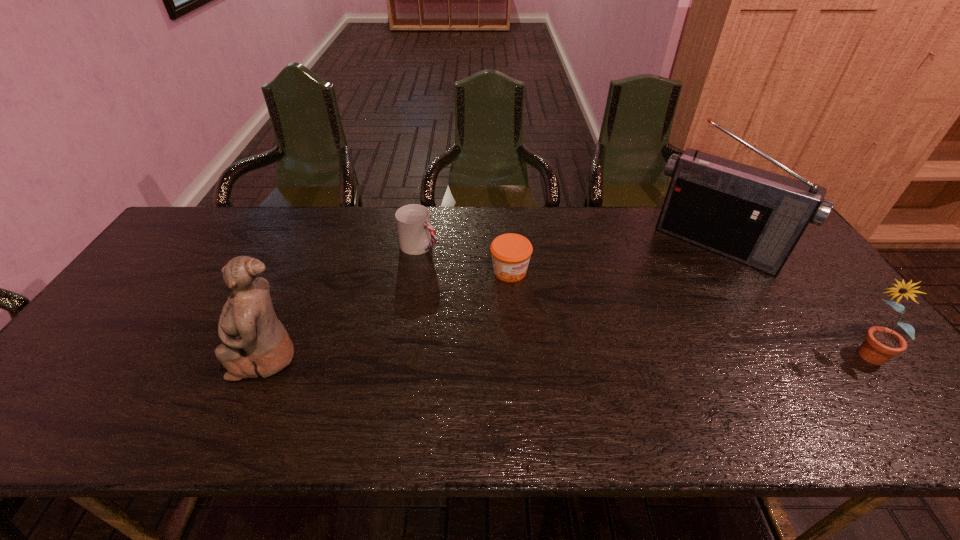
The height and width of the screenshot is (540, 960). I want to click on vacant space situated 0.250m on the front-facing side of the leftmost object, so click(132, 355).

Find the location of a particular element. This screenshot has height=540, width=960. free space located 0.320m on the front label of the shortest object is located at coordinates (604, 359).

Locate an element on the screen. The image size is (960, 540). vacant point located 0.280m on the front label of the shortest object is located at coordinates (592, 348).

I want to click on free location located on the front label of the shortest object, so click(555, 313).

Where is `vacant space located 0.220m on the handle side of the second shortest object`? The height and width of the screenshot is (540, 960). vacant space located 0.220m on the handle side of the second shortest object is located at coordinates (489, 287).

Find the location of a particular element. This screenshot has width=960, height=540. vacant space located on the handle side of the second shortest object is located at coordinates (468, 274).

At what (x,y) coordinates should I click in order to perform the action: click on blank space located 0.350m on the handle side of the second shortest object. Please return your answer as a coordinate pair (x, y). The width and height of the screenshot is (960, 540). Looking at the image, I should click on (525, 309).

This screenshot has height=540, width=960. Find the location of `vacant space located 0.300m on the front-facing side of the radio receiver`. vacant space located 0.300m on the front-facing side of the radio receiver is located at coordinates (651, 335).

You are a GUI agent. You are given a task and a screenshot of the screen. Output one action in this format:
    pyautogui.click(x=<x>, y=<y>)
    Task: Click on the vacant space located on the front-facing side of the radio receiver
    This screenshot has height=540, width=960.
    Given the screenshot: What is the action you would take?
    pyautogui.click(x=650, y=337)

Identify the location of free space located 0.320m on the front-facing side of the radio receiver. (648, 340).